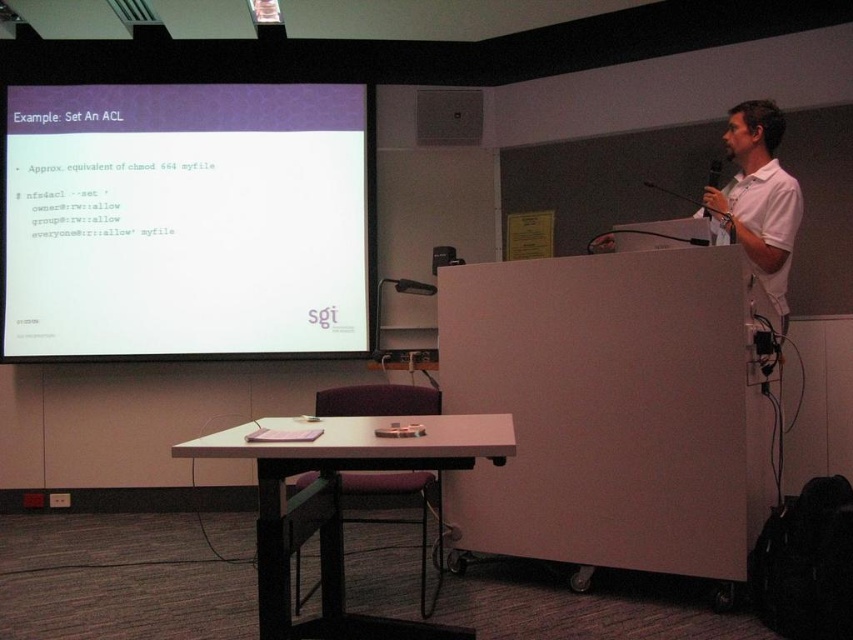
What do you see at coordinates (339, 506) in the screenshot?
I see `white plastic podium at center` at bounding box center [339, 506].

Can you confirm if white plastic podium at center is taller than white cotton shirt at upper right?

Incorrect, white plastic podium at center's height is not larger of white cotton shirt at upper right's.

Is point (392, 460) positioned behind point (730, 211)?

No, (392, 460) is in front of (730, 211).

Locate an element on the screen. The width and height of the screenshot is (853, 640). white plastic podium at center is located at coordinates (339, 506).

Who is shorter, white matte projector screen at upper left or white plastic podium at center?

white plastic podium at center is shorter.

The image size is (853, 640). Describe the element at coordinates (184, 220) in the screenshot. I see `white matte projector screen at upper left` at that location.

Locate an element on the screen. white matte projector screen at upper left is located at coordinates (184, 220).

Between white matte projector screen at upper left and white cotton shirt at upper right, which one appears on the right side from the viewer's perspective?

white cotton shirt at upper right is more to the right.

From the picture: Could you measure the distance between white matte projector screen at upper left and white cotton shirt at upper right?

white matte projector screen at upper left and white cotton shirt at upper right are 2.38 meters apart.

Is point (158, 211) closer to viewer compared to point (757, 204)?

No.

What are the coordinates of `white matte projector screen at upper left` in the screenshot? It's located at (184, 220).